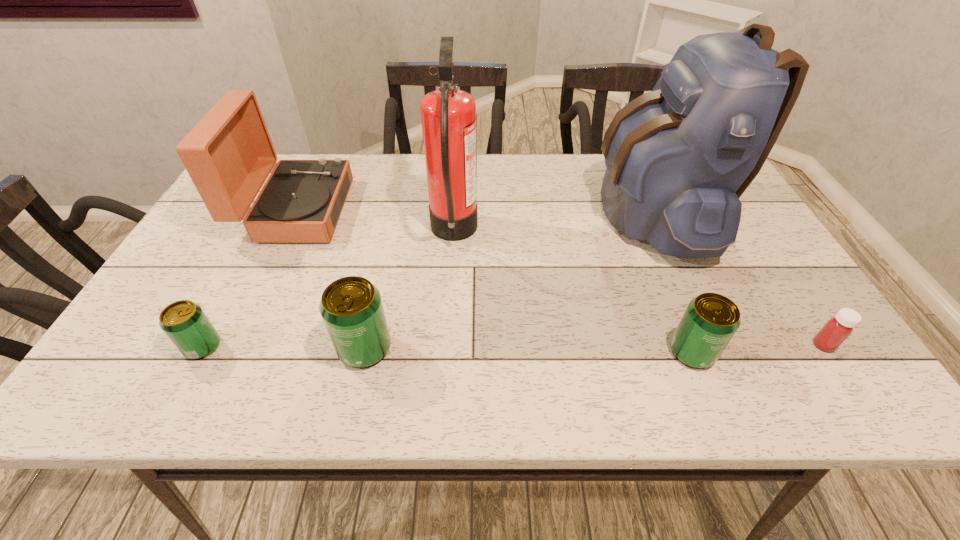
Please determine a free point for an extra beer_can to ensure balance. Please provide its 2D coordinates. Your answer should be formatted as a tuple, i.e. [(x, y)], where the tuple contains the x and y coordinates of a point satisfying the conditions above.

[(528, 350)]